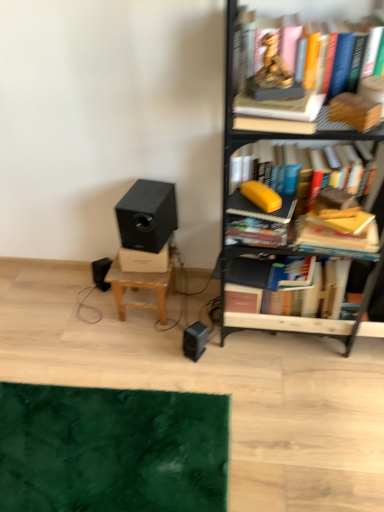
You are a GUI agent. You are given a task and a screenshot of the screen. Output one action in this format:
    pyautogui.click(x=<x>, y=<y>)
    Task: Click on the vacant space situated on the left part of metallic black bookcase at right
    This screenshot has height=512, width=384.
    Given the screenshot: What is the action you would take?
    pyautogui.click(x=182, y=350)